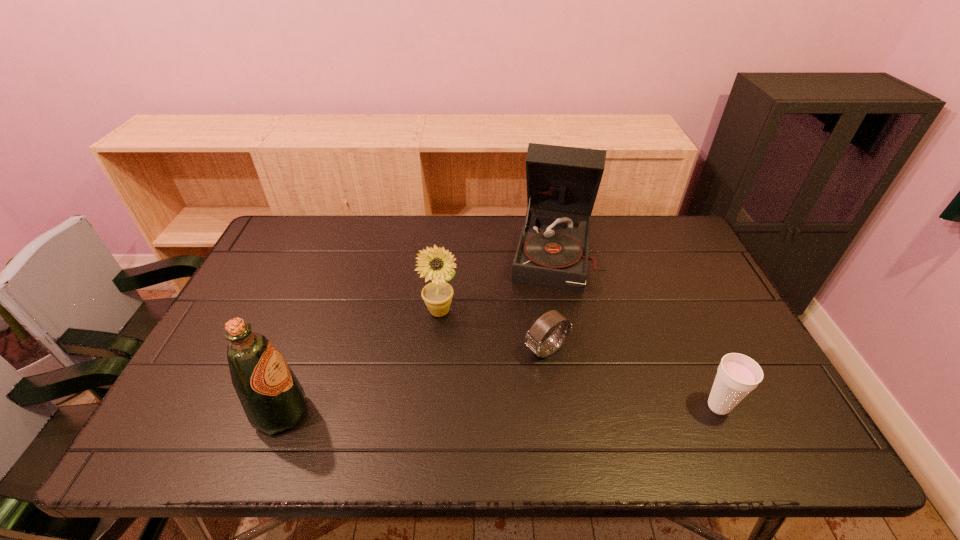
This screenshot has height=540, width=960. What are the coordinates of `vacant position at the far left corner of the desktop` in the screenshot? It's located at (304, 243).

Image resolution: width=960 pixels, height=540 pixels. I want to click on unoccupied area between the farthest object and the fourth tallest object, so click(636, 329).

Where is `vacant area that lies between the leftmost object and the tallest object`? Image resolution: width=960 pixels, height=540 pixels. vacant area that lies between the leftmost object and the tallest object is located at coordinates (418, 332).

This screenshot has height=540, width=960. In order to click on vacant region between the phonograph_record and the fourth tallest object in this screenshot , I will do click(x=636, y=329).

Locate an element on the screen. Image resolution: width=960 pixels, height=540 pixels. vacant space that is in between the leftmost object and the farthest object is located at coordinates (418, 332).

The height and width of the screenshot is (540, 960). I want to click on free space between the second tallest object and the fourth object from right to left, so click(x=361, y=362).

Locate an element on the screen. free spot between the tallest object and the sunflower is located at coordinates (496, 281).

Identify the location of empty location between the farthest object and the third tallest object. This screenshot has width=960, height=540. (496, 281).

Where is `vacant space that's between the second tallest object and the cup`? vacant space that's between the second tallest object and the cup is located at coordinates (500, 409).

The height and width of the screenshot is (540, 960). Find the location of `free space between the cup and the shortest object`. free space between the cup and the shortest object is located at coordinates (633, 378).